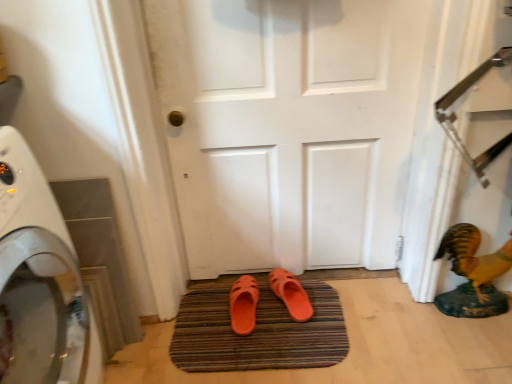
Where is `vacant space that is in between shiny gold statue at lower right and orange rubber bath mat at center`? vacant space that is in between shiny gold statue at lower right and orange rubber bath mat at center is located at coordinates (386, 319).